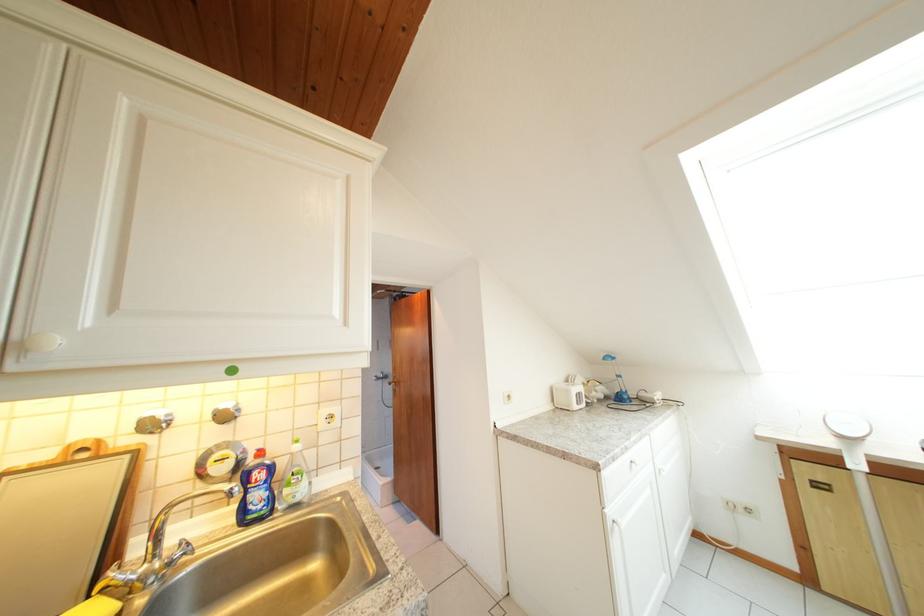
Where is `small fan heater`? The image size is (924, 616). small fan heater is located at coordinates (568, 395).